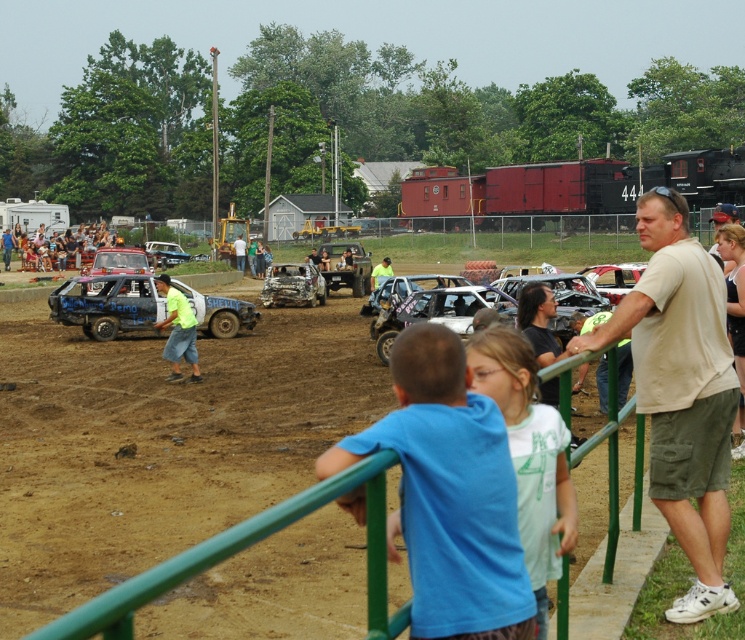
In the scene shown: Can you confirm if blue cotton shirt at center is smaller than beige cotton shirt at right?

Yes, blue cotton shirt at center is smaller than beige cotton shirt at right.

Does blue cotton shirt at center appear under beige cotton shirt at right?

Actually, blue cotton shirt at center is above beige cotton shirt at right.

The width and height of the screenshot is (745, 640). Identify the location of blue cotton shirt at center. (448, 493).

Locate an element on the screen. blue cotton shirt at center is located at coordinates (448, 493).

Consider the image. Can you confirm if blue cotton shirt at center is wider than white cotton shirt at center?

Yes, blue cotton shirt at center is wider than white cotton shirt at center.

Is blue cotton shirt at center below white cotton shirt at center?

Yes, blue cotton shirt at center is below white cotton shirt at center.

I want to click on blue cotton shirt at center, so click(x=448, y=493).

Where is `blue cotton shirt at center`? This screenshot has width=745, height=640. blue cotton shirt at center is located at coordinates (448, 493).

Is beige cotton shirt at right thinner than rusty metal car at center?

Indeed, beige cotton shirt at right has a lesser width compared to rusty metal car at center.

Between beige cotton shirt at right and rusty metal car at center, which one is positioned lower?

beige cotton shirt at right is below.

The height and width of the screenshot is (640, 745). Identify the location of beige cotton shirt at right. (681, 392).

In order to click on beige cotton shirt at right in this screenshot , I will do pos(681,392).